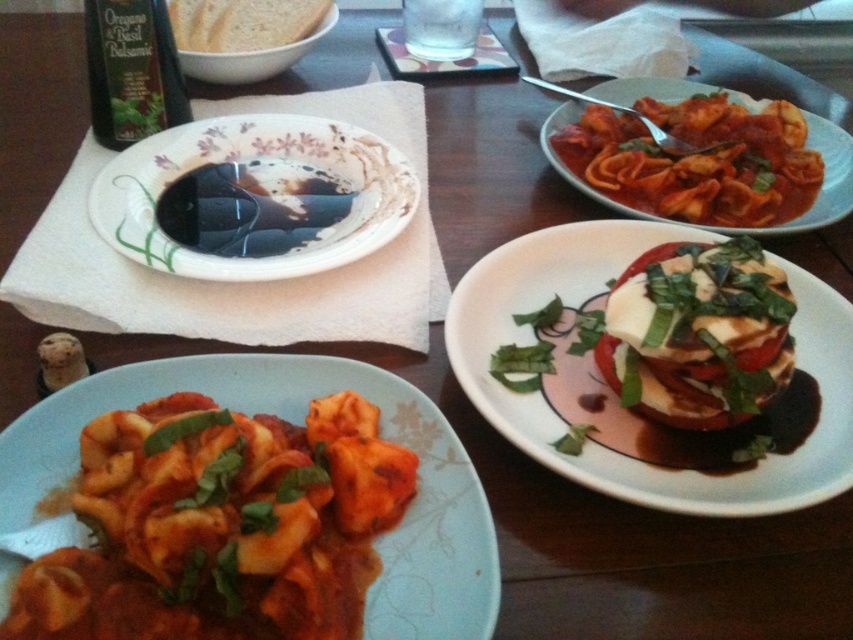
Is white glossy plate at center to the right of black glossy bowl at upper center from the viewer's perspective?

Indeed, white glossy plate at center is positioned on the right side of black glossy bowl at upper center.

Does point (650, 504) come closer to viewer compared to point (257, 216)?

Yes.

Does point (753, 481) lie behind point (283, 177)?

No, it is not.

The width and height of the screenshot is (853, 640). In order to click on white glossy plate at center in this screenshot , I will do click(608, 449).

Between matte tortellini at lower left and white matte bread at upper left, which one is positioned lower?

Positioned lower is matte tortellini at lower left.

Is point (117, 483) farther from camera compared to point (195, 28)?

No, (117, 483) is in front of (195, 28).

In order to click on matte tortellini at lower left in this screenshot , I will do `click(219, 525)`.

Between matte tortellini at lower left and white glossy plate at center, which one has more height?

white glossy plate at center

Who is shorter, matte tortellini at lower left or white glossy plate at center?

Standing shorter between the two is matte tortellini at lower left.

Is point (276, 636) more distant than point (463, 372)?

No, it is in front of (463, 372).

The width and height of the screenshot is (853, 640). I want to click on matte tortellini at lower left, so click(x=219, y=525).